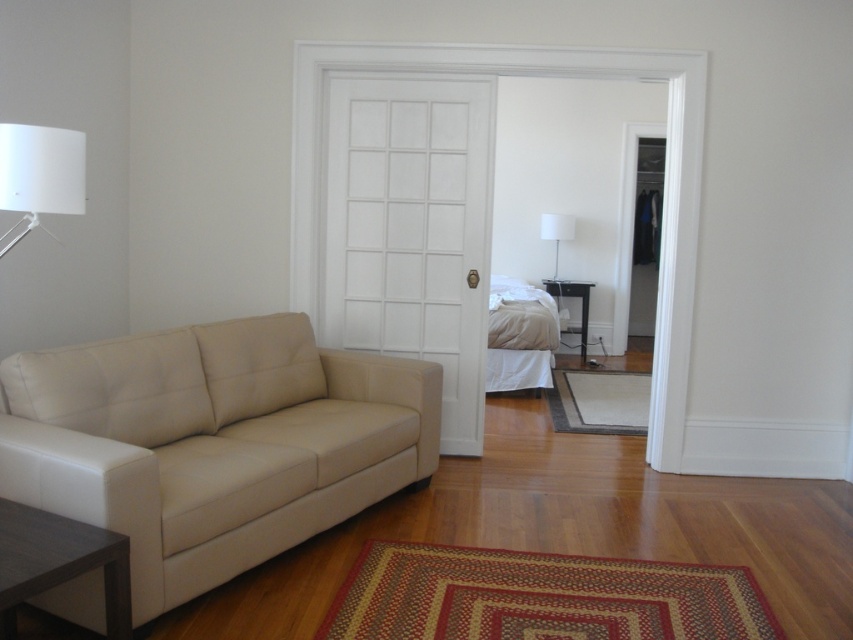
You are arranging a photo shoot in the living room and need to position two lamps. The scene includes a white matte lampshade at upper left and a white fabric lampshade at center. Which lamp should you choose if you want the taller one for the main lighting setup?

The white fabric lampshade at center is taller than the white matte lampshade at upper left, so you should choose the white fabric lampshade at center for the main lighting setup.

You are an interior designer assessing the lighting in the living room. You notice the white matte lampshade at upper left and the white fabric lampshade at center. Which lampshade has a larger size?

The white fabric lampshade at center is larger than the white matte lampshade at upper left.

You are standing in the living room and want to place a 1.5 meter long sofa on the floor. The sofa will be placed in the same position as the brown wood table at lower left. Will there be enough space for the sofa to fit without overlapping any existing furniture?

The distance between the brown wood table at lower left and the viewer is 1.68 meters. Since the sofa is 1.5 meters long, it would fit within that space as it is shorter than the available distance. However, the question mentions placing the sofa in the same position as the table, which might require removing the table first to avoid overlap. The spatial dimensions suggest it could work if the table is moved.